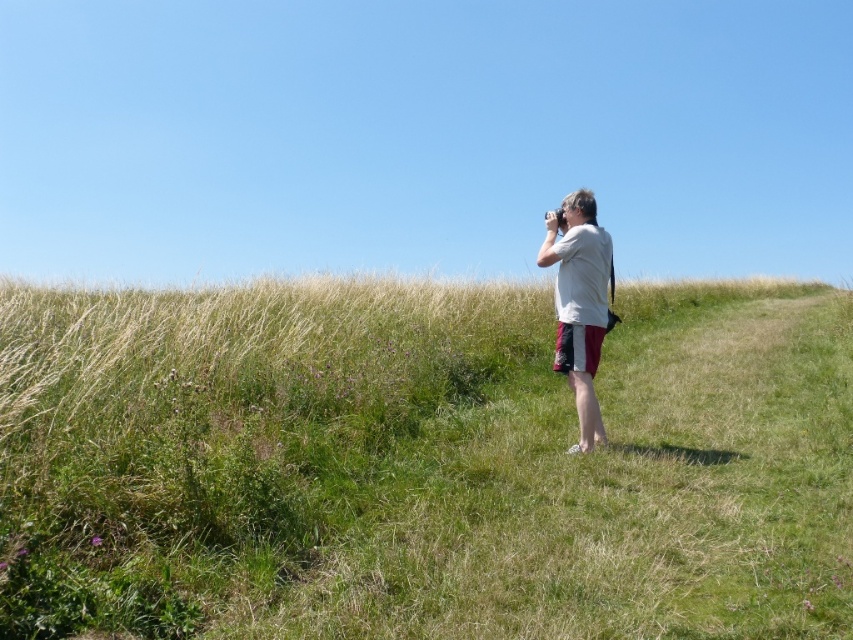
Between green grassy hillside at center and white cotton shirt at center, which one appears on the right side from the viewer's perspective?

From the viewer's perspective, white cotton shirt at center appears more on the right side.

Is green grassy hillside at center positioned behind white cotton shirt at center?

No, it is not.

This screenshot has width=853, height=640. Describe the element at coordinates (422, 461) in the screenshot. I see `green grassy hillside at center` at that location.

What are the coordinates of `green grassy hillside at center` in the screenshot? It's located at (422, 461).